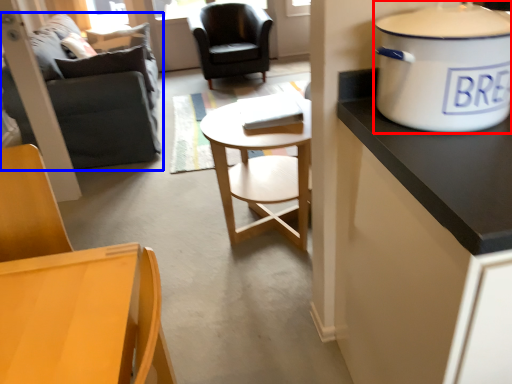
Question: Which of the following is the farthest to the observer, cooker (highlighted by a red box) or studio couch (highlighted by a blue box)?

Choices:
 (A) cooker
 (B) studio couch

Answer: (B)